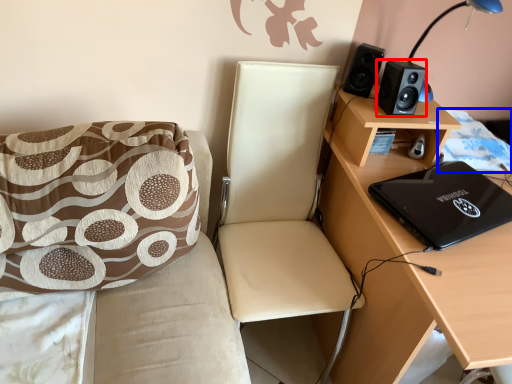
Question: Which object appears farthest to the camera in this image, speaker (highlighted by a red box) or quilt (highlighted by a blue box)?

Choices:
 (A) speaker
 (B) quilt

Answer: (B)